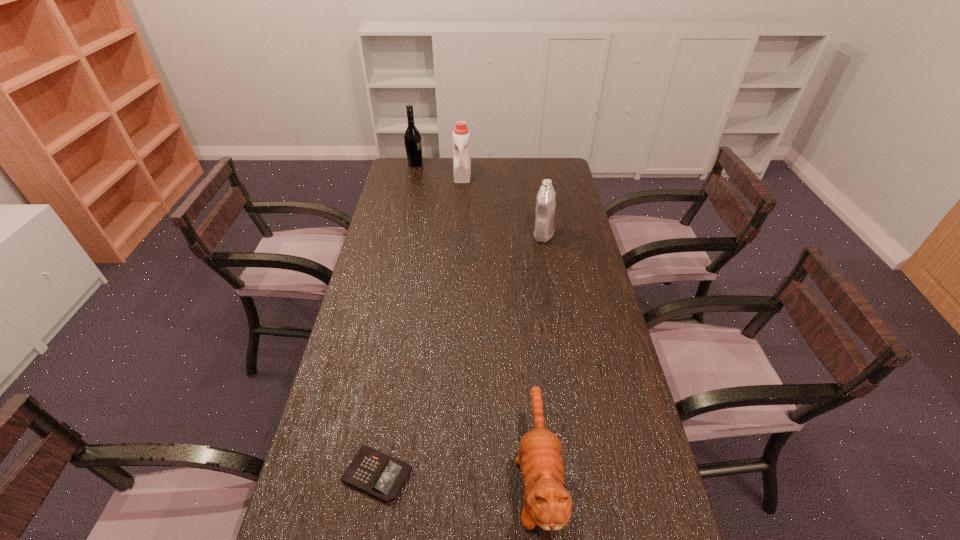
Find the location of `free space between the wine bottle and the shortest object`. free space between the wine bottle and the shortest object is located at coordinates (396, 319).

The width and height of the screenshot is (960, 540). What are the coordinates of `free spot between the right detergent and the wine bottle` in the screenshot? It's located at (479, 199).

The width and height of the screenshot is (960, 540). Identify the location of empty space that is in between the wine bottle and the third nearest object. (479, 199).

Find the location of a particular element. The width and height of the screenshot is (960, 540). free area in between the calculator and the left detergent is located at coordinates (420, 324).

The width and height of the screenshot is (960, 540). Find the location of `free spot between the wine bottle and the rightmost object`. free spot between the wine bottle and the rightmost object is located at coordinates click(x=479, y=199).

Identify which object is located as the fourth nearest to the wine bottle. Please provide its 2D coordinates. Your answer should be formatted as a tuple, i.e. [(x, y)], where the tuple contains the x and y coordinates of a point satisfying the conditions above.

[(378, 474)]

You are a GUI agent. You are given a task and a screenshot of the screen. Output one action in this format:
    pyautogui.click(x=<x>, y=<y>)
    Task: Click on the object that is the third closest to the cat
    Image resolution: width=960 pixels, height=540 pixels.
    Given the screenshot: What is the action you would take?
    pyautogui.click(x=461, y=135)

I want to click on vacant point that satisfies the following two spatial constraints: 1. on the label of the wine bottle; 2. on the back side of the third farthest object, so 400,235.

Find the location of a particular element. The height and width of the screenshot is (540, 960). free space that satisfies the following two spatial constraints: 1. on the label of the rightmost object; 2. on the right side of the wine bottle is located at coordinates coord(400,235).

The image size is (960, 540). I want to click on vacant space that satisfies the following two spatial constraints: 1. on the label of the nearer detergent; 2. on the right side of the wine bottle, so click(x=400, y=235).